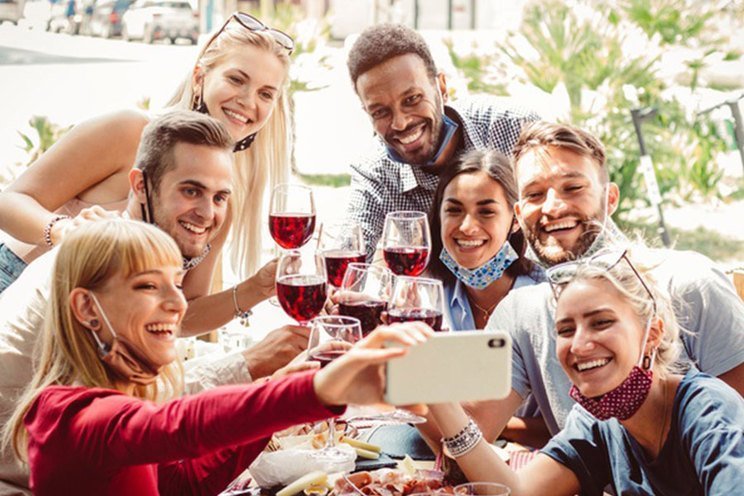
Locate an element on the screen. Image resolution: width=744 pixels, height=496 pixels. wine glasses is located at coordinates (411, 293), (367, 282), (402, 240), (346, 237), (298, 204), (307, 265).